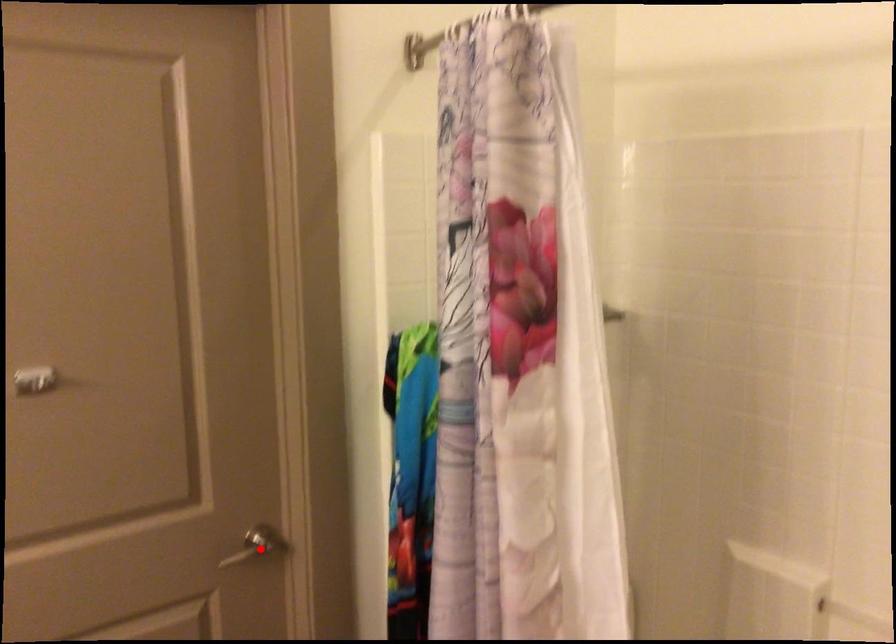
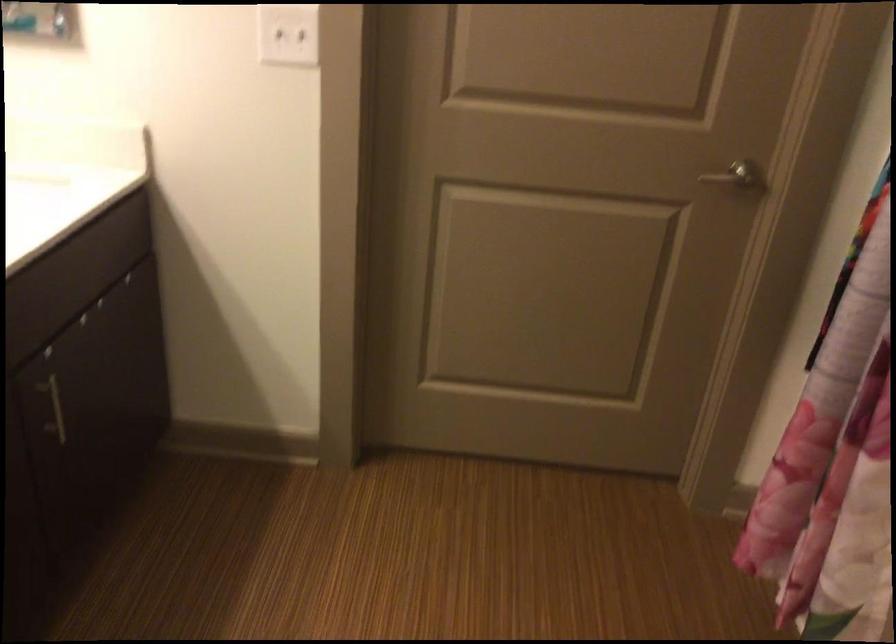
Locate, in the second image, the point that corresponds to the highlighted location in the first image.

(739, 178)